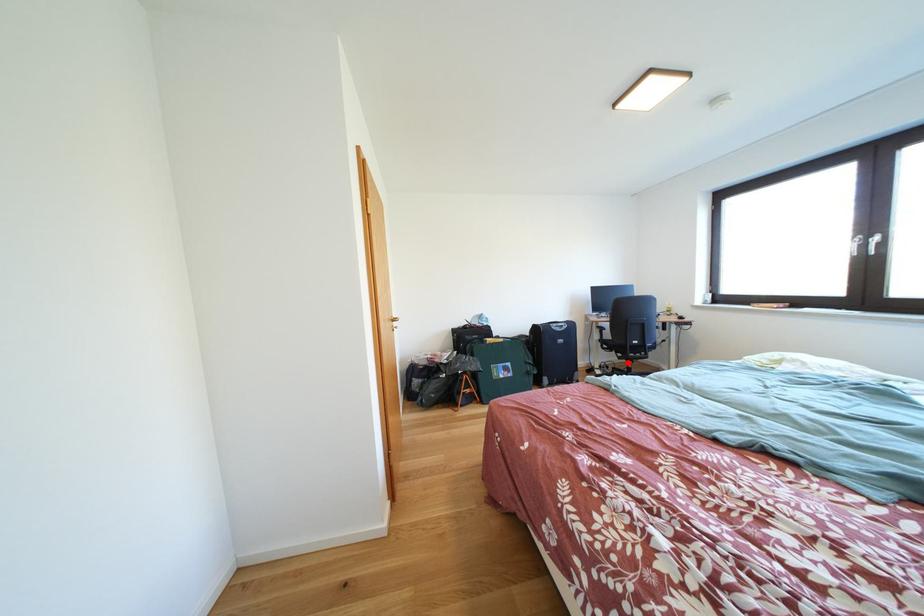
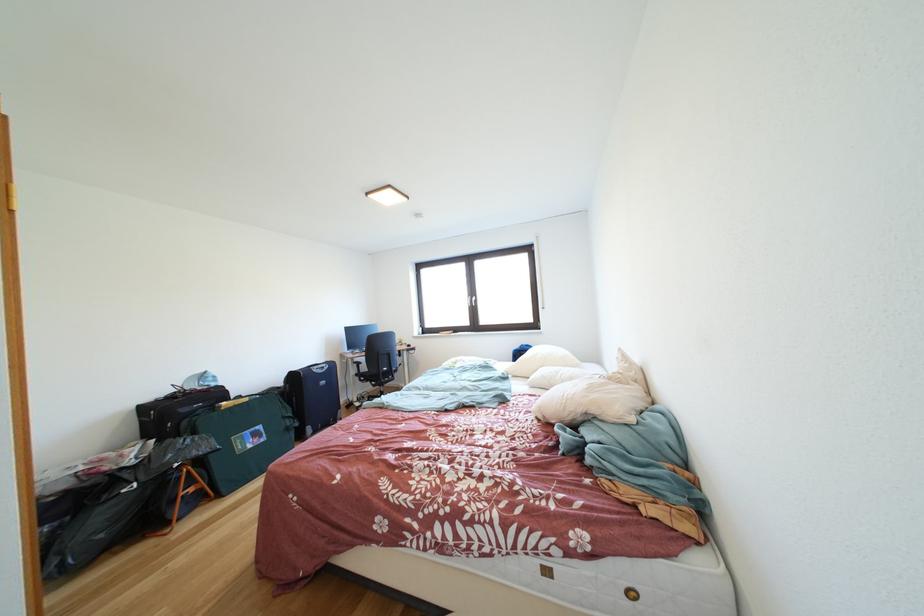
Locate, in the second image, the point that corresponds to the highlighted location in the first image.

(383, 391)